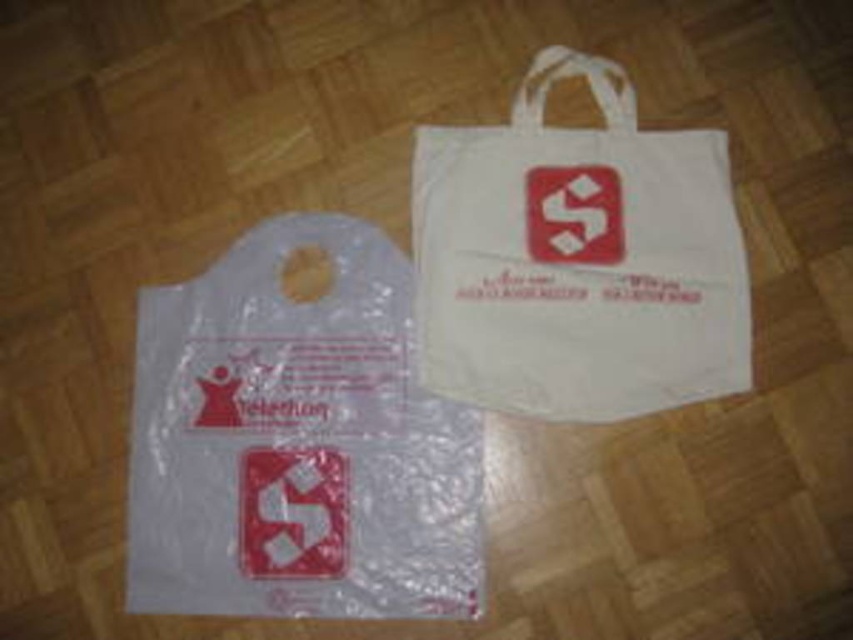
You are organizing items in a storage room and need to determine which bag can hold more items based on their sizes. Given the transparent plastic bag at lower left and the white fabric bag at upper right, which one is taller?

The transparent plastic bag at lower left is taller than the white fabric bag at upper right, so it can potentially hold more items vertically.